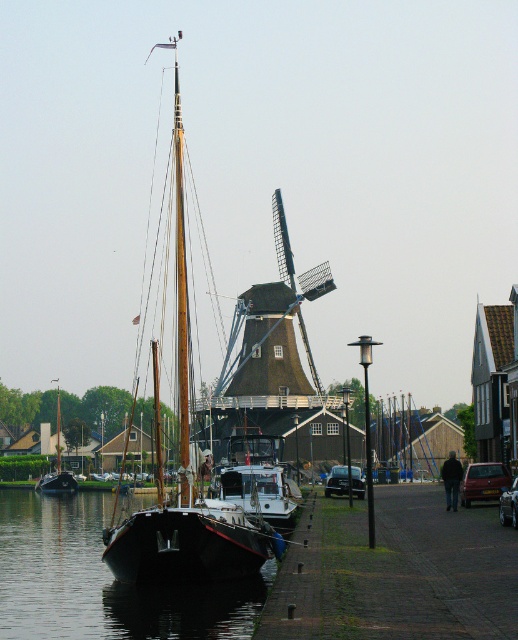
Can you confirm if white matte boat at center is shorter than wooden boat at left?

Yes, white matte boat at center is shorter than wooden boat at left.

Who is more distant from viewer, (x=286, y=490) or (x=66, y=480)?

Positioned behind is point (x=66, y=480).

Is point (284, 522) in front of point (56, 419)?

Yes.

Where is `white matte boat at center`? The image size is (518, 640). white matte boat at center is located at coordinates (257, 477).

Locate an element on the screen. The width and height of the screenshot is (518, 640). wooden sailboat at center is located at coordinates (185, 476).

Describe the element at coordinates (185, 476) in the screenshot. I see `wooden sailboat at center` at that location.

This screenshot has height=640, width=518. What are the coordinates of `wooden sailboat at center` in the screenshot? It's located at (185, 476).

Between point (49, 636) and point (73, 483), which one is positioned in front?

Point (49, 636) is more forward.

Can you confirm if black glossy water at lower left is positioned to the right of wooden boat at left?

Correct, you'll find black glossy water at lower left to the right of wooden boat at left.

Is point (205, 612) in front of point (57, 428)?

Yes, point (205, 612) is in front of point (57, 428).

This screenshot has width=518, height=640. I want to click on black glossy water at lower left, so click(102, 580).